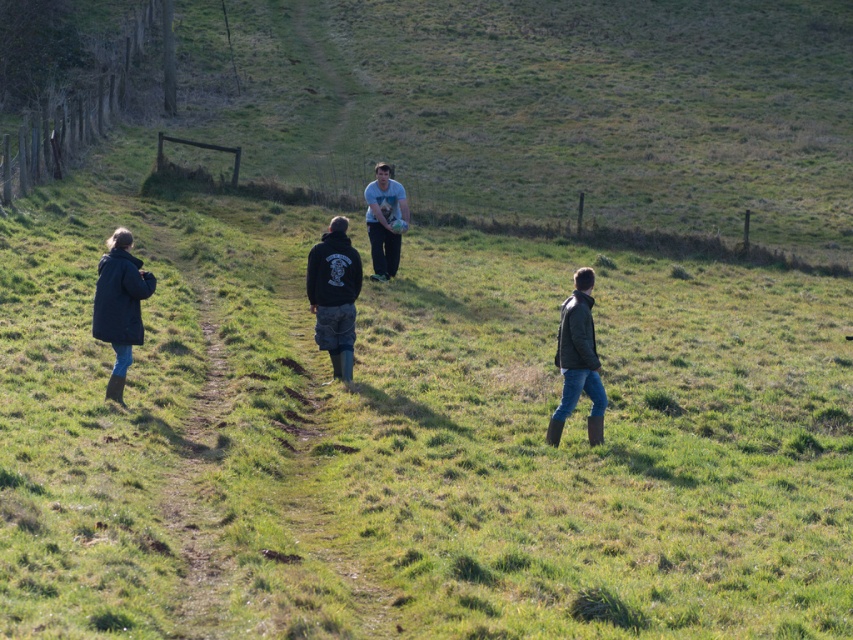
Question: Which of the following is the closest to the observer?

Choices:
 (A) (132, 300)
 (B) (306, 275)
 (C) (595, 364)
 (D) (375, 200)

Answer: (C)

Question: Which object is the closest to the leather jacket at center?

Choices:
 (A) black matte jacket at center
 (B) white matte t-shirt at center
 (C) dark blue jacket at left

Answer: (A)

Question: Considering the relative positions of dark blue jacket at left and white matte t-shirt at center in the image provided, where is dark blue jacket at left located with respect to white matte t-shirt at center?

Choices:
 (A) above
 (B) below

Answer: (B)

Question: Estimate the real-world distances between objects in this image. Which object is closer to the white matte t-shirt at center?

Choices:
 (A) black matte jacket at center
 (B) dark blue jacket at left

Answer: (A)

Question: In this image, where is black matte jacket at center located relative to dark blue jacket at left?

Choices:
 (A) below
 (B) above

Answer: (B)

Question: Does dark blue jacket at left appear on the right side of leather jacket at center?

Choices:
 (A) yes
 (B) no

Answer: (B)